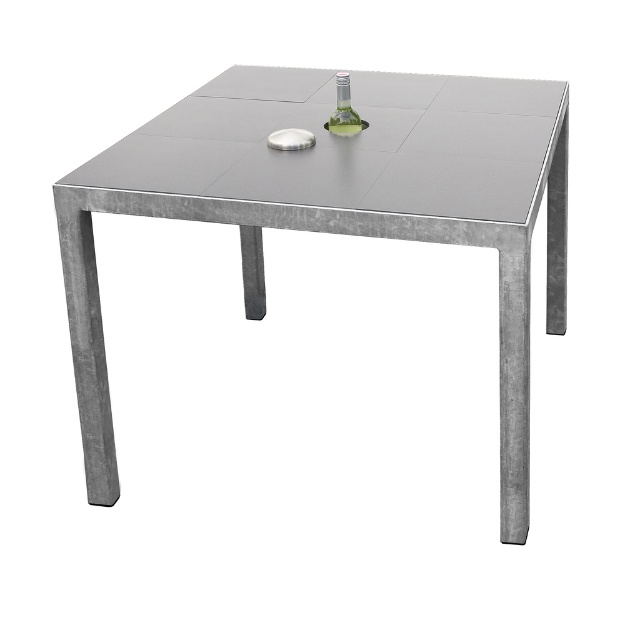
Based on the photo, you are standing at the edge of the table and want to place a small coaster between the metallic gray table at center and the transparent glass bottle at center. Which object should you move closer to first?

The transparent glass bottle at center is to the left of the metallic gray table at center, so you should move closer to the transparent glass bottle at center first to place the coaster between them.

You are arranging items on the metallic gray table at center. You have a transparent glass bottle at center that you want to place in the center of the table. Will the bottle fit entirely within the table without overhanging the edges?

The metallic gray table at center might be wider than transparent glass bottle at center, so there is a possibility that the transparent glass bottle at center will fit within the table. However, since the exact dimensions are not provided, it is uncertain. Please verify the measurements before placing the bottle.

You are standing at the origin point in the coordinate system of the image. Which direction should you move to reach the metallic gray table at center?

The metallic gray table at center is located at point (337, 208). Since the origin is at the bottom left corner, you should move to the right and upwards to reach it.